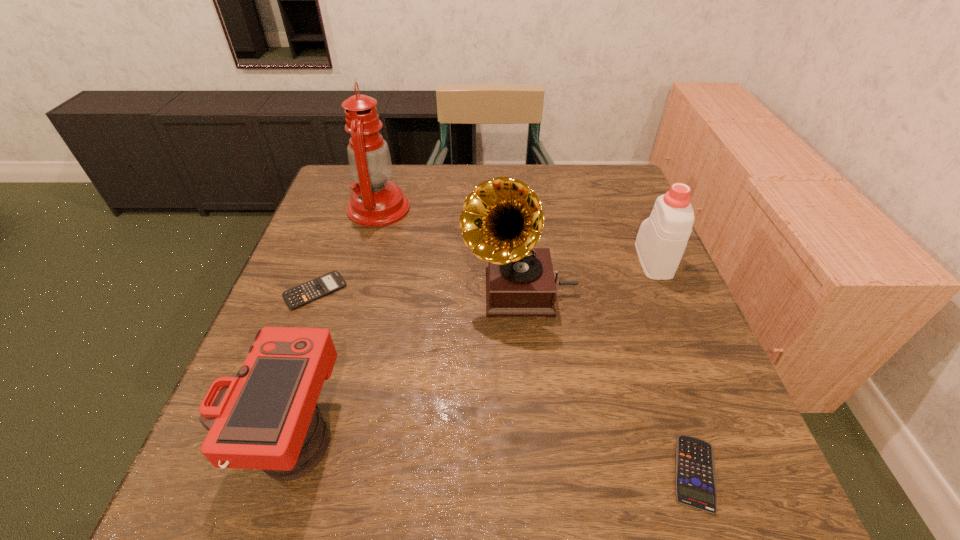
Identify the location of oil lamp. (376, 202).

Locate an element on the screen. The image size is (960, 540). the tallest object is located at coordinates (376, 202).

You are a GUI agent. You are given a task and a screenshot of the screen. Output one action in this format:
    pyautogui.click(x=<x>, y=<y>)
    Task: Click on the third object from right to left
    The height and width of the screenshot is (540, 960).
    Given the screenshot: What is the action you would take?
    pyautogui.click(x=502, y=219)

The image size is (960, 540). Find the location of `the second tallest object`. the second tallest object is located at coordinates (502, 219).

Image resolution: width=960 pixels, height=540 pixels. Find the location of `the third tallest object`. the third tallest object is located at coordinates (662, 238).

Locate an element on the screen. The image size is (960, 540). camera is located at coordinates (263, 417).

This screenshot has width=960, height=540. Identify the location of the farther calculator. (300, 295).

At what (x,y) coordinates should I click in order to perform the action: click on the nearer calculator. Please return your answer as a coordinate pair (x, y). This screenshot has width=960, height=540. Looking at the image, I should click on [x=695, y=473].

Image resolution: width=960 pixels, height=540 pixels. Identify the location of the right calculator. (695, 473).

The height and width of the screenshot is (540, 960). What are the coordinates of `free spot located 0.070m on the left of the oil lamp` in the screenshot? It's located at (323, 208).